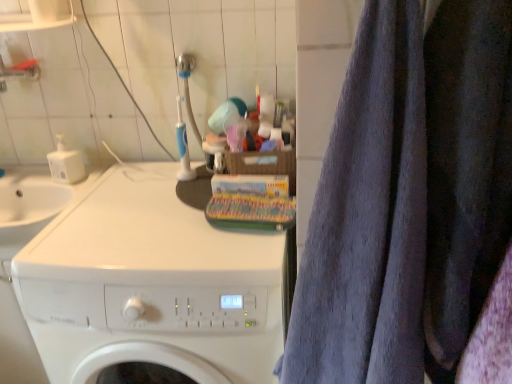
Question: Does white glossy washing machine at center have a greater width compared to dark blue fabric at right?

Choices:
 (A) yes
 (B) no

Answer: (A)

Question: Is white glossy washing machine at center shorter than dark blue fabric at right?

Choices:
 (A) no
 (B) yes

Answer: (A)

Question: From a real-world perspective, is white glossy washing machine at center located higher than dark blue fabric at right?

Choices:
 (A) no
 (B) yes

Answer: (A)

Question: Could you tell me if white glossy washing machine at center is facing dark blue fabric at right?

Choices:
 (A) no
 (B) yes

Answer: (A)

Question: From the image's perspective, would you say white glossy washing machine at center is shown under dark blue fabric at right?

Choices:
 (A) no
 (B) yes

Answer: (B)

Question: Is white glossy washing machine at center oriented away from dark blue fabric at right?

Choices:
 (A) no
 (B) yes

Answer: (A)

Question: Does gray terry cloth towel at right have a lesser width compared to dark blue fabric at right?

Choices:
 (A) yes
 (B) no

Answer: (B)

Question: From a real-world perspective, is gray terry cloth towel at right over dark blue fabric at right?

Choices:
 (A) yes
 (B) no

Answer: (B)

Question: Is gray terry cloth towel at right bigger than dark blue fabric at right?

Choices:
 (A) yes
 (B) no

Answer: (A)

Question: Would you say dark blue fabric at right is part of gray terry cloth towel at right's contents?

Choices:
 (A) no
 (B) yes

Answer: (A)

Question: Is gray terry cloth towel at right at the right side of dark blue fabric at right?

Choices:
 (A) no
 (B) yes

Answer: (A)

Question: Can you confirm if gray terry cloth towel at right is smaller than dark blue fabric at right?

Choices:
 (A) no
 (B) yes

Answer: (A)

Question: Is white glossy washing machine at center at the right side of gray terry cloth towel at right?

Choices:
 (A) yes
 (B) no

Answer: (B)